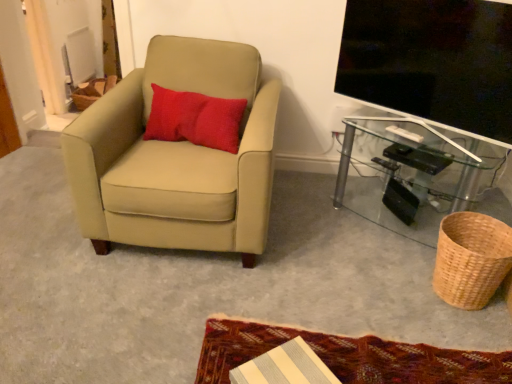
Identify the location of vacant area that lies between suede beige armchair at left and woven natural basket at lower right. (326, 244).